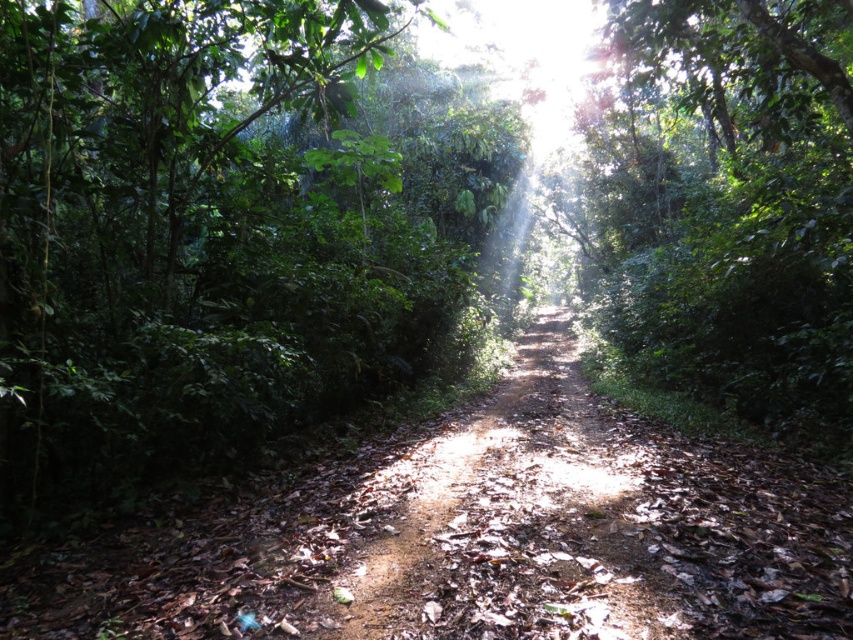
Does green leafy tree at center have a lesser width compared to dirt path at center?

In fact, green leafy tree at center might be wider than dirt path at center.

Does green leafy tree at center have a greater width compared to dirt path at center?

Yes.

Where is `green leafy tree at center`? green leafy tree at center is located at coordinates (733, 208).

At what (x,y) coordinates should I click in order to perform the action: click on green leafy tree at center. Please return your answer as a coordinate pair (x, y). This screenshot has width=853, height=640. Looking at the image, I should click on (733, 208).